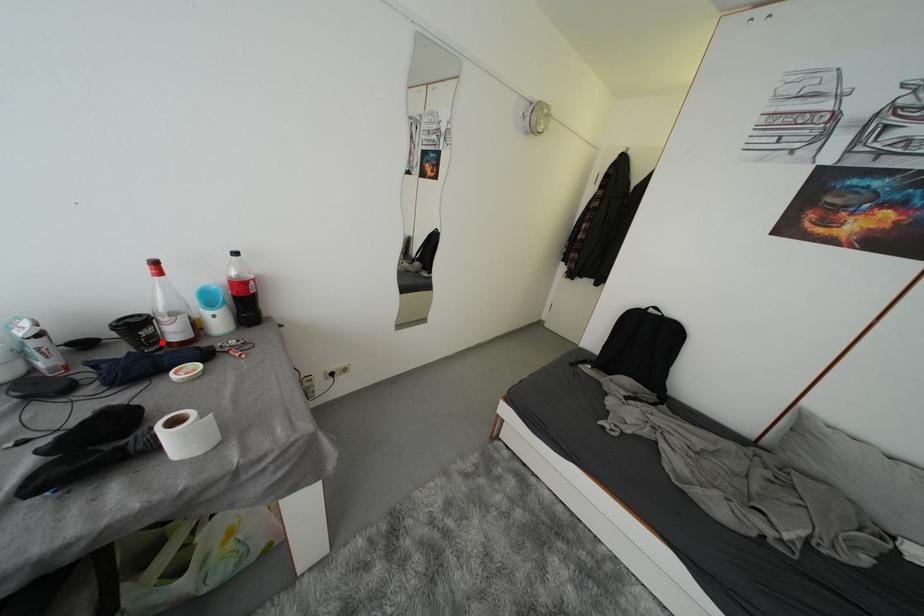
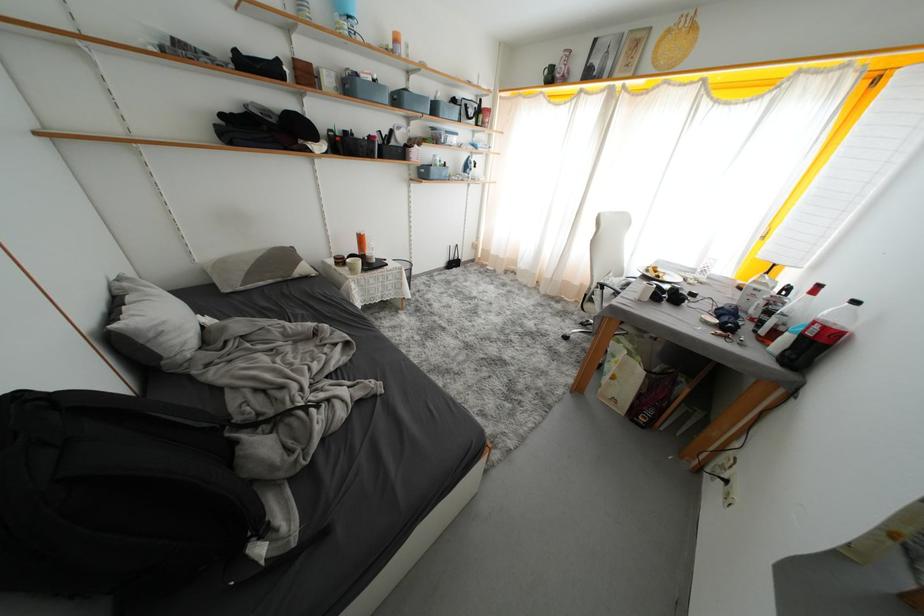
Find the pixel in the second image that matches the highlighted location in the first image.

(767, 328)